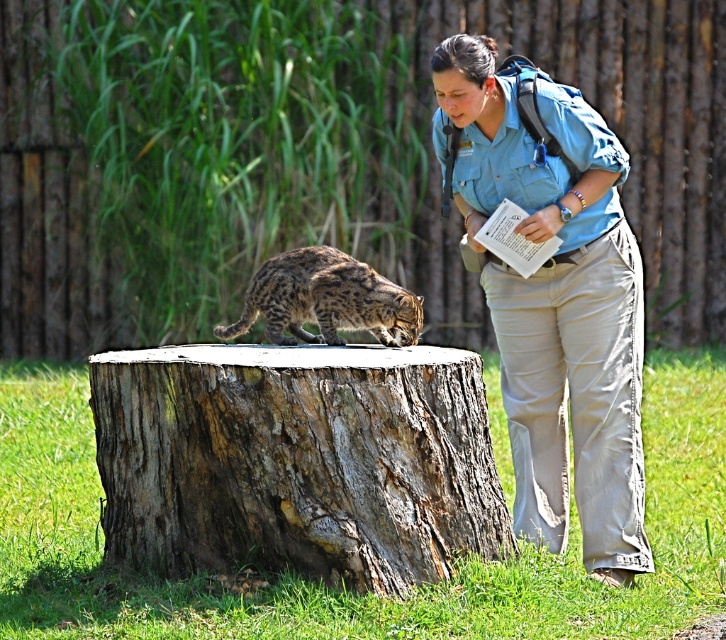
Does rough bark tree stump at center have a lesser width compared to blue uniform at center?

No.

Can you confirm if rough bark tree stump at center is positioned below blue uniform at center?

Correct, rough bark tree stump at center is located below blue uniform at center.

Is point (264, 392) positioned in front of point (469, 60)?

Yes, it is.

Identify the location of rough bark tree stump at center. Image resolution: width=726 pixels, height=640 pixels. point(297,461).

In the scene shown: Who is lower down, rough bark tree stump at center or spotted fur cat at center?

rough bark tree stump at center is lower down.

Is rough bark tree stump at center closer to the viewer compared to spotted fur cat at center?

That is True.

Between point (319, 572) and point (420, 308), which one is positioned in front?

Point (319, 572) is more forward.

Find the location of a particular element. This screenshot has height=640, width=726. rough bark tree stump at center is located at coordinates (297, 461).

Describe the element at coordinates (554, 296) in the screenshot. I see `blue uniform at center` at that location.

Identify the location of blue uniform at center. (554, 296).

Is point (616, 246) positioned behind point (301, 252)?

Yes, point (616, 246) is farther from viewer.

The image size is (726, 640). I want to click on blue uniform at center, so click(554, 296).